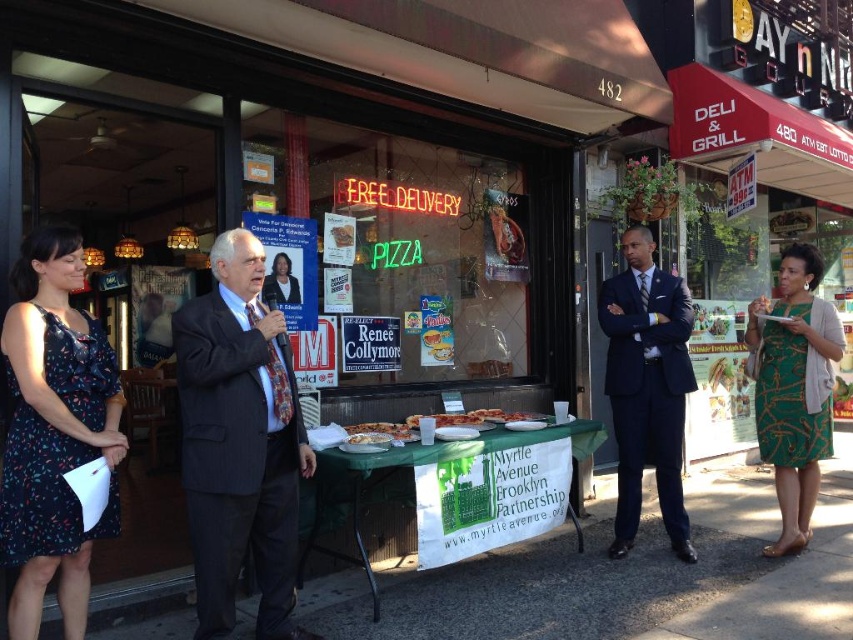
Does pinstriped suit at center have a smaller size compared to matte black suit at center?

Actually, pinstriped suit at center might be larger than matte black suit at center.

Which of these two, pinstriped suit at center or matte black suit at center, stands shorter?

With less height is matte black suit at center.

The width and height of the screenshot is (853, 640). What are the coordinates of `pinstriped suit at center` in the screenshot? It's located at (239, 442).

Where is `dark floral dress at left`? The width and height of the screenshot is (853, 640). dark floral dress at left is located at coordinates (54, 429).

Who is more forward, (38, 522) or (766, 387)?

Point (38, 522) is in front.

Locate an element on the screen. dark floral dress at left is located at coordinates (54, 429).

You are a GUI agent. You are given a task and a screenshot of the screen. Output one action in this format:
    pyautogui.click(x=<x>, y=<y>)
    Task: Click on the dark floral dress at left
    This screenshot has width=853, height=640.
    Given the screenshot: What is the action you would take?
    pyautogui.click(x=54, y=429)

Is navy blue suit at center shorter than green printed dress at right?

In fact, navy blue suit at center may be taller than green printed dress at right.

At what (x,y) coordinates should I click in order to perform the action: click on navy blue suit at center. Please return your answer as a coordinate pair (x, y). Image resolution: width=853 pixels, height=640 pixels. Looking at the image, I should click on (647, 387).